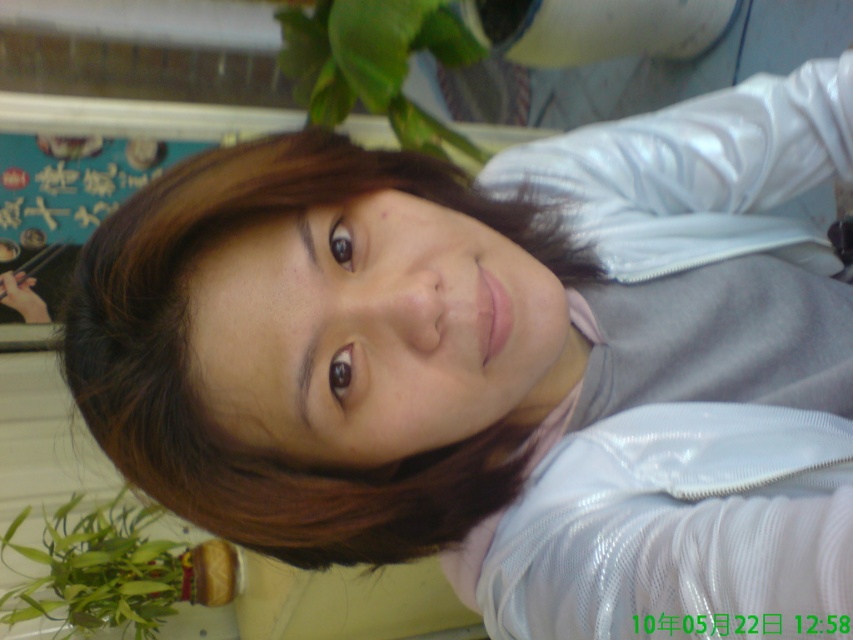
Based on the scene description, can you determine which object is closer to the camera between the brown shiny hair at upper center and the green leafy plant at upper center?

The brown shiny hair at upper center is in front of the green leafy plant at upper center, so it is closer to the camera.

You are a photographer analyzing the composition of this selfie. The image has a point at coordinates point (190, 387). Based on the scene description, what object does this point most likely represent?

The point at coordinates point (190, 387) corresponds to the brown shiny hair at upper center.

Based on the scene description, which object is smaller in size between the brown shiny hair at upper center and the green leafy plant at lower left?

The brown shiny hair at upper center is smaller than the green leafy plant at lower left according to the description.